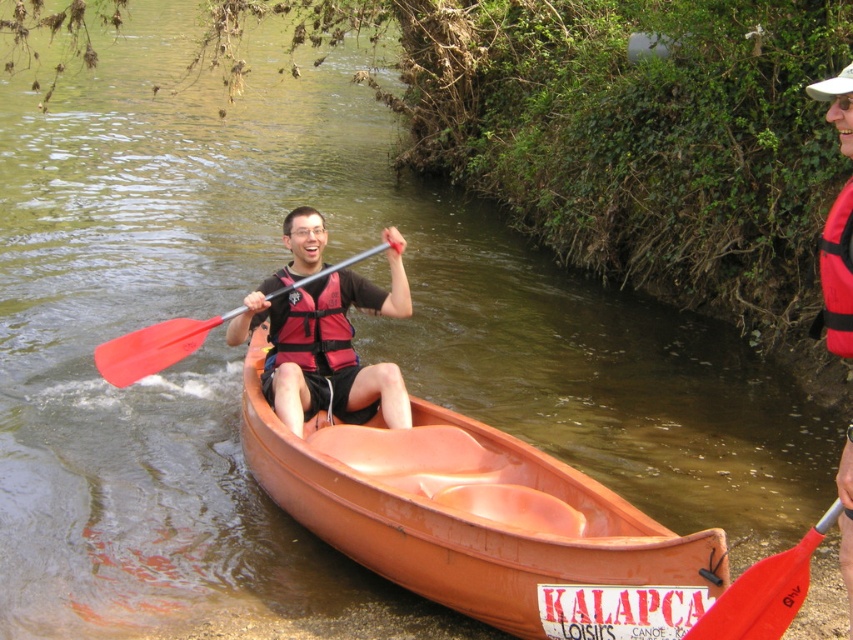
You are a photographer trying to capture the red rubber paddle at lower right. The camera you are using has a field of view that can only capture objects within a 0.2 unit radius from the center point. If you center your camera at point (764, 592), will the red rubber paddle at lower right be fully within the camera frame?

The point (764, 592) marks the red rubber paddle at lower right. Since the camera is centered at this exact point, the paddle will be fully within the 0.2 unit radius frame, so yes, it will be fully captured.

You are a photographer trying to capture a photo of the red rubber paddle at lower right. Your camera is positioned at the same height as the paddle. If the camera has a focal length of 50mm, what is the approximate distance in meters between the paddle and the camera to ensure the paddle fills the frame properly?

The red rubber paddle at lower right and camera are 3.81 meters apart. To ensure the paddle fills the frame properly with a 50mm focal length, the distance should be approximately 3.81 meters.

You are standing at the edge of the river and want to reach the point marked as point (x=735, y=616). If your maximum reach is 4 meters, can you reach it without moving closer to the river?

The point (x=735, y=616) is 3.98 meters from the camera, so yes, you can reach it without moving closer since it is within your 4 meter reach.